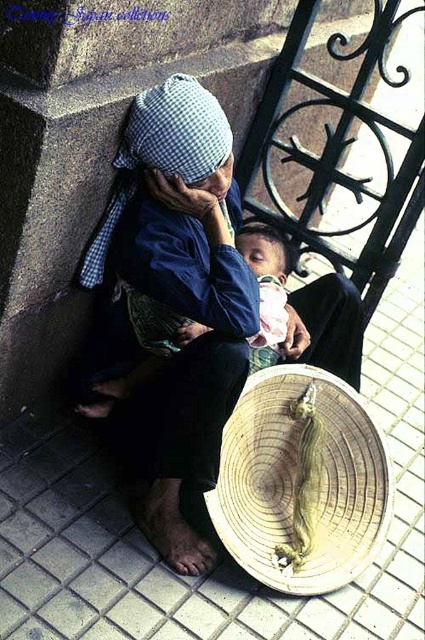
Is woven straw basket at lower center to the right of white checkered fabric at upper left from the viewer's perspective?

Yes, woven straw basket at lower center is to the right of white checkered fabric at upper left.

Who is shorter, woven straw basket at lower center or white checkered fabric at upper left?

Standing shorter between the two is white checkered fabric at upper left.

Find the location of `woven straw basket at lower center`. woven straw basket at lower center is located at coordinates (302, 481).

Which of these two, blue checkered fabric at center or woven straw basket at lower center, stands taller?

Standing taller between the two is blue checkered fabric at center.

Is blue checkered fabric at center bigger than woven straw basket at lower center?

Yes, blue checkered fabric at center is bigger than woven straw basket at lower center.

Where is `blue checkered fabric at center`? Image resolution: width=425 pixels, height=640 pixels. blue checkered fabric at center is located at coordinates (172, 301).

In order to click on blue checkered fabric at center in this screenshot , I will do `click(172, 301)`.

Does white tile pavement at lower center have a larger size compared to woven straw basket at lower center?

Correct, white tile pavement at lower center is larger in size than woven straw basket at lower center.

Between white tile pavement at lower center and woven straw basket at lower center, which one is positioned higher?

white tile pavement at lower center

Which is behind, point (422, 316) or point (223, 467)?

The point (422, 316) is behind.

This screenshot has height=640, width=425. In order to click on white tile pavement at lower center in this screenshot , I will do `click(223, 564)`.